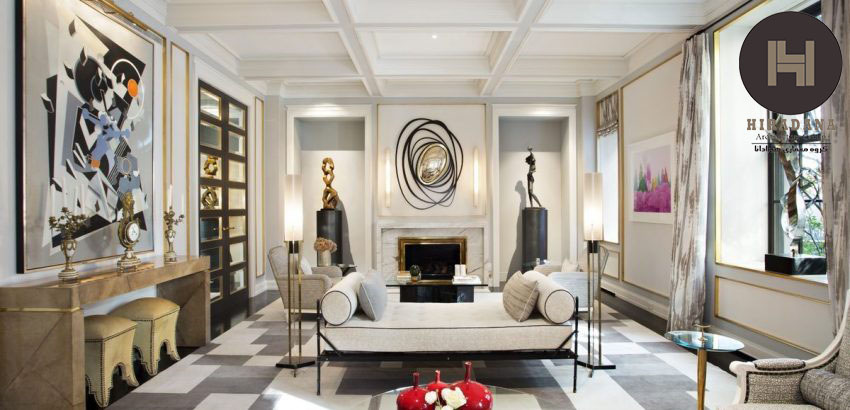
You are a GUI agent. You are given a task and a screenshot of the screen. Output one action in this format:
    pyautogui.click(x=<x>, y=<y>)
    Task: Click on the fire place
    The height and width of the screenshot is (410, 850).
    Given the screenshot: What is the action you would take?
    pyautogui.click(x=439, y=265)